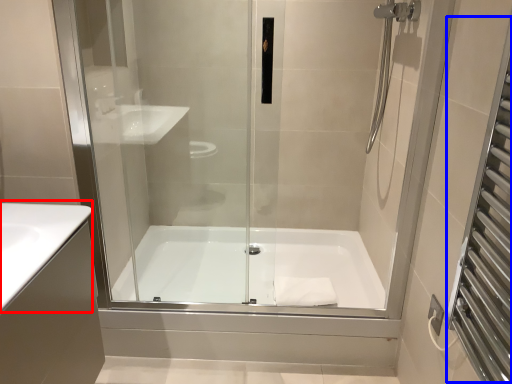
Question: Among these objects, which one is nearest to the camera, counter top (highlighted by a red box) or screen door (highlighted by a blue box)?

Choices:
 (A) counter top
 (B) screen door

Answer: (B)